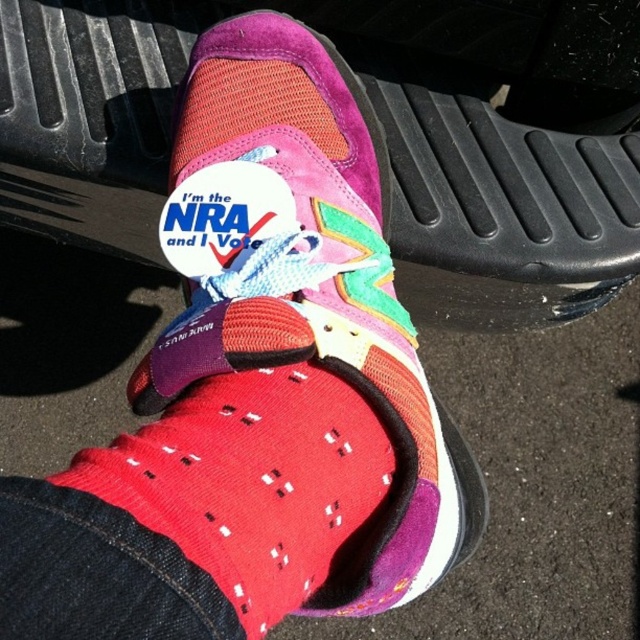
Question: Does suede/mesh sneaker at center appear on the left side of red knitted sock at lower center?

Choices:
 (A) yes
 (B) no

Answer: (B)

Question: Which object is farther from the camera taking this photo?

Choices:
 (A) suede/mesh sneaker at center
 (B) red knitted sock at lower center

Answer: (A)

Question: Does suede/mesh sneaker at center appear under red knitted sock at lower center?

Choices:
 (A) no
 (B) yes

Answer: (A)

Question: Which object is closer to the camera taking this photo?

Choices:
 (A) suede/mesh sneaker at center
 (B) red knitted sock at lower center

Answer: (B)

Question: Which object is closer to the camera taking this photo?

Choices:
 (A) red knitted sock at lower center
 (B) suede/mesh sneaker at center

Answer: (A)

Question: Can you confirm if suede/mesh sneaker at center is thinner than red knitted sock at lower center?

Choices:
 (A) no
 (B) yes

Answer: (A)